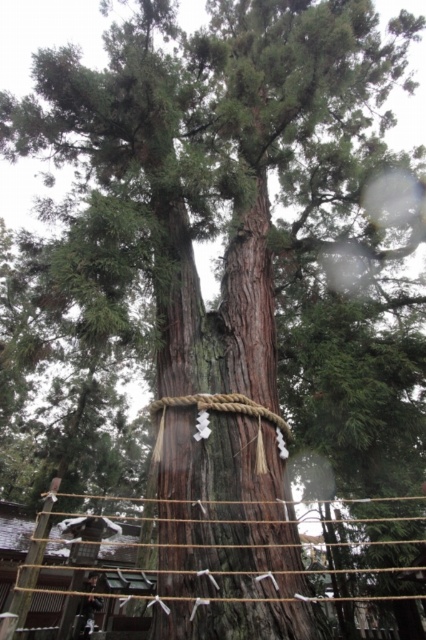
Who is taller, brown rough tree trunk at center or braided wood rope bridge at center?

braided wood rope bridge at center is taller.

Locate an element on the screen. brown rough tree trunk at center is located at coordinates (227, 536).